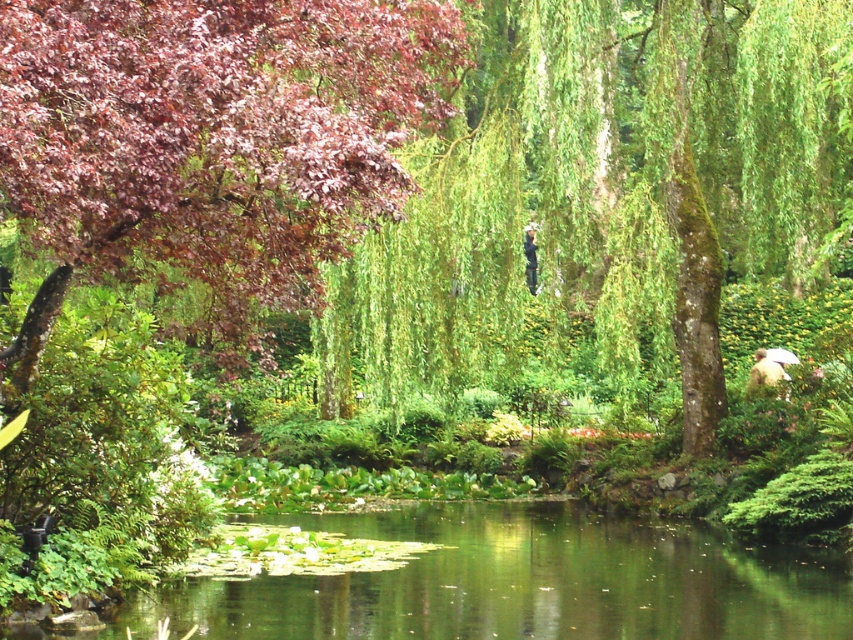
Is green leafy willow at center closer to the viewer compared to green liquid water at center?

Yes, it is in front of green liquid water at center.

Which is below, green leafy willow at center or green liquid water at center?

green liquid water at center

The image size is (853, 640). Identify the location of green leafy willow at center. (606, 193).

Is green liquid water at center above camouflage jacket at lower right?

Actually, green liquid water at center is below camouflage jacket at lower right.

Who is more forward, (647, 532) or (753, 392)?

Point (647, 532) is more forward.

Who is more distant from viewer, (786, 552) or (759, 380)?

The point (759, 380) is behind.

You are a GUI agent. You are given a task and a screenshot of the screen. Output one action in this format:
    pyautogui.click(x=<x>, y=<y>)
    Task: Click on the green liquid water at center
    Image resolution: width=853 pixels, height=640 pixels.
    Given the screenshot: What is the action you would take?
    pyautogui.click(x=521, y=582)

What do you see at coordinates (606, 193) in the screenshot?
I see `green leafy willow at center` at bounding box center [606, 193].

Is green leafy willow at center shorter than dark blue fabric at center?

No.

Measure the distance between green leafy willow at center and camera.

11.28 meters

Locate an element on the screen. The height and width of the screenshot is (640, 853). green leafy willow at center is located at coordinates (606, 193).